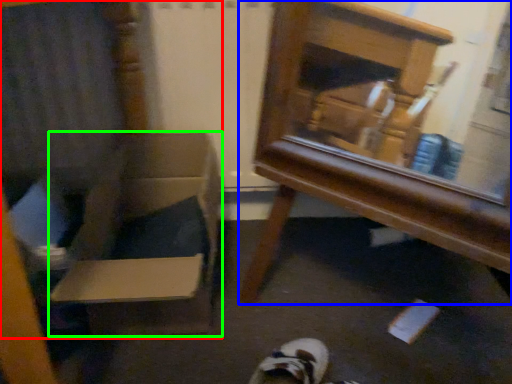
Question: Which is nearer to the armchair (highlighted by a red box)? furniture (highlighted by a blue box) or cardboard box (highlighted by a green box).

Choices:
 (A) furniture
 (B) cardboard box

Answer: (B)